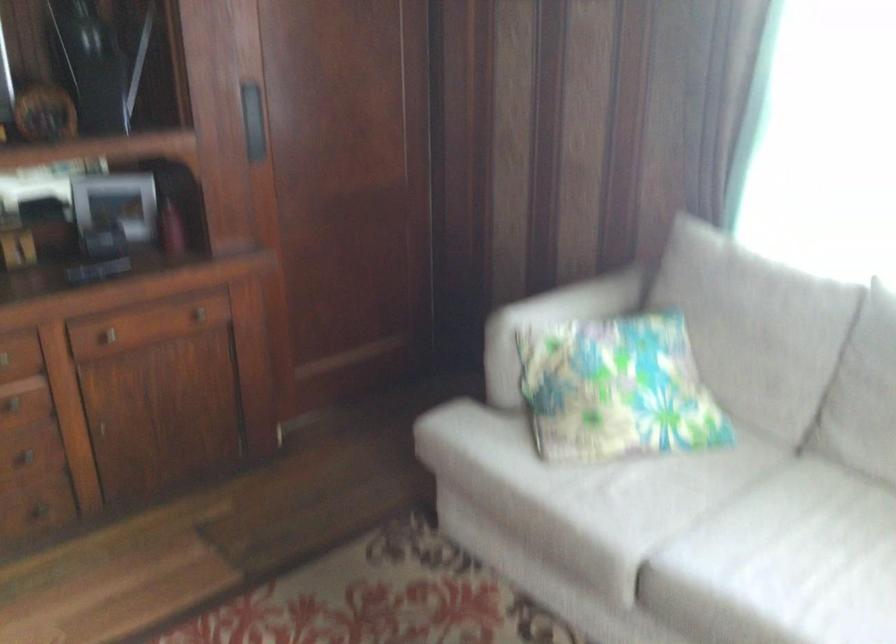
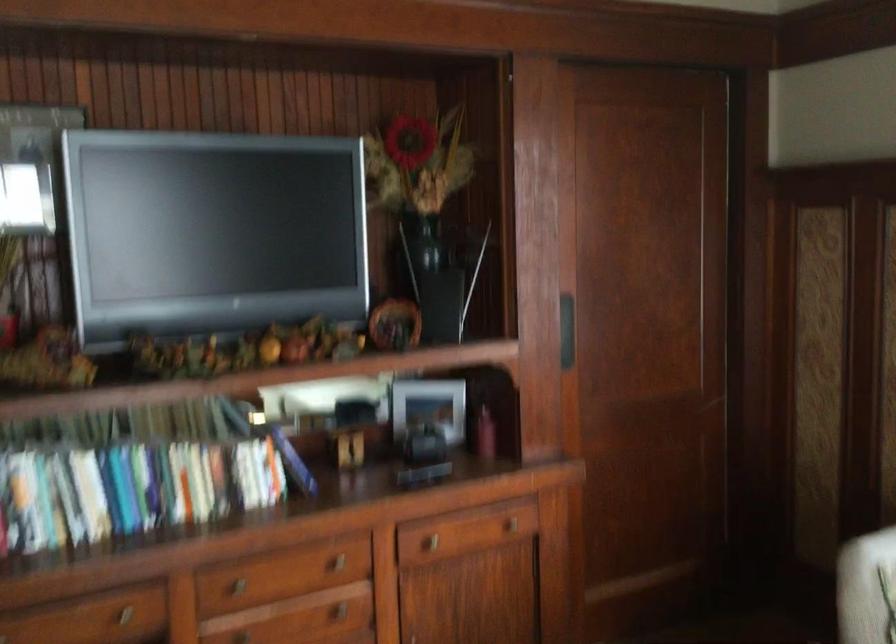
The point at (255, 118) is marked in the first image. Where is the corresponding point in the second image?

(565, 330)